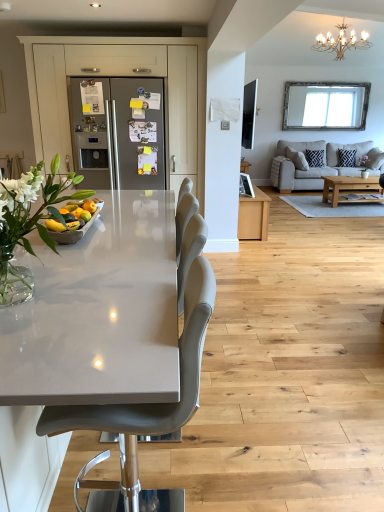
Question: From a real-world perspective, does beige fabric couch at right stand above black woven pillow at upper right, which is counted as the 1th pillow, starting from the left?

Choices:
 (A) yes
 (B) no

Answer: (B)

Question: Can you confirm if beige fabric couch at right is positioned to the right of black woven pillow at upper right, which appears as the 2th pillow when viewed from the right?

Choices:
 (A) no
 (B) yes

Answer: (B)

Question: Is the depth of beige fabric couch at right less than that of black woven pillow at upper right, which is counted as the 1th pillow, starting from the left?

Choices:
 (A) no
 (B) yes

Answer: (B)

Question: Is beige fabric couch at right facing towards black woven pillow at upper right, which appears as the 2th pillow when viewed from the right?

Choices:
 (A) yes
 (B) no

Answer: (A)

Question: Can you confirm if beige fabric couch at right is bigger than black woven pillow at upper right, which is counted as the 1th pillow, starting from the left?

Choices:
 (A) yes
 (B) no

Answer: (A)

Question: From the image's perspective, relative to gold metallic chandelier at upper right, is satin silver refrigerator at center above or below?

Choices:
 (A) above
 (B) below

Answer: (B)

Question: Looking at the image, does satin silver refrigerator at center seem bigger or smaller compared to gold metallic chandelier at upper right?

Choices:
 (A) small
 (B) big

Answer: (B)

Question: Visually, is satin silver refrigerator at center positioned to the left or to the right of gold metallic chandelier at upper right?

Choices:
 (A) left
 (B) right

Answer: (A)

Question: Considering the positions of satin silver refrigerator at center and gold metallic chandelier at upper right in the image, is satin silver refrigerator at center taller or shorter than gold metallic chandelier at upper right?

Choices:
 (A) short
 (B) tall

Answer: (B)

Question: Is navy blue textured cushion at center right, the 2th pillow from the left, inside the boundaries of matte gray chair at center, or outside?

Choices:
 (A) outside
 (B) inside

Answer: (A)

Question: From the image's perspective, is navy blue textured cushion at center right, the 2th pillow from the left, located above or below matte gray chair at center?

Choices:
 (A) above
 (B) below

Answer: (A)

Question: Considering the positions of point (354, 161) and point (81, 422), is point (354, 161) closer or farther from the camera than point (81, 422)?

Choices:
 (A) farther
 (B) closer

Answer: (A)

Question: In terms of width, does navy blue textured cushion at center right, the 1th pillow positioned from the right, look wider or thinner when compared to matte gray chair at center?

Choices:
 (A) thin
 (B) wide

Answer: (A)

Question: In terms of height, does matte gray chair at center look taller or shorter compared to beige fabric couch at right?

Choices:
 (A) short
 (B) tall

Answer: (B)

Question: Would you say matte gray chair at center is inside or outside beige fabric couch at right?

Choices:
 (A) outside
 (B) inside

Answer: (A)